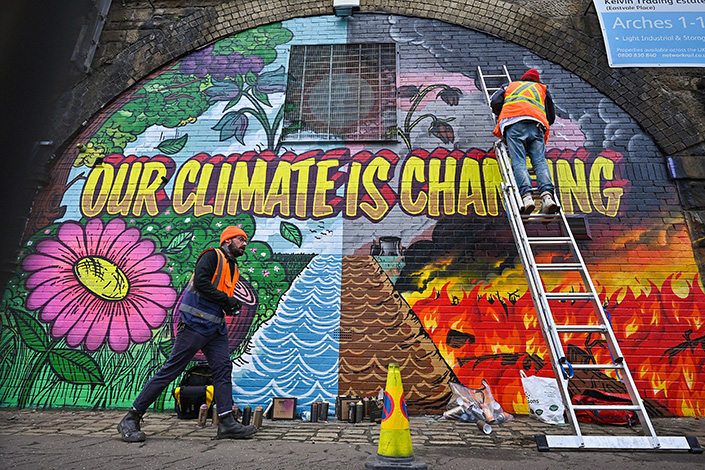
Find the location of a particular element. This screenshot has height=470, width=705. vent is located at coordinates (314, 130).